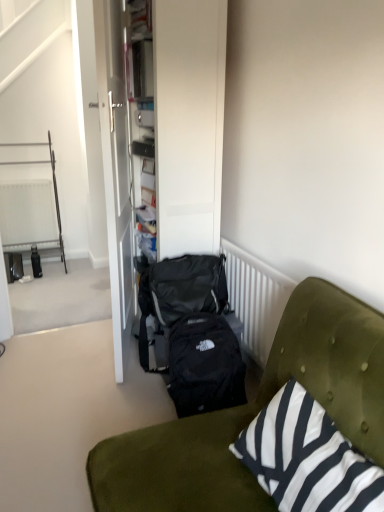
Locate an element on the screen. The image size is (384, 512). vacant space that is to the left of black fabric backpack at center, the second backpack positioned from the top is located at coordinates (133, 404).